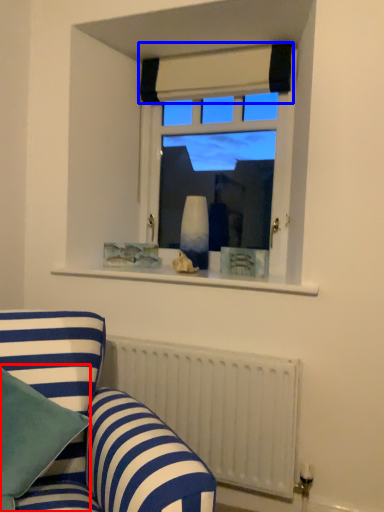
Question: Which object is further to the camera taking this photo, pillow (highlighted by a red box) or curtain (highlighted by a blue box)?

Choices:
 (A) pillow
 (B) curtain

Answer: (B)